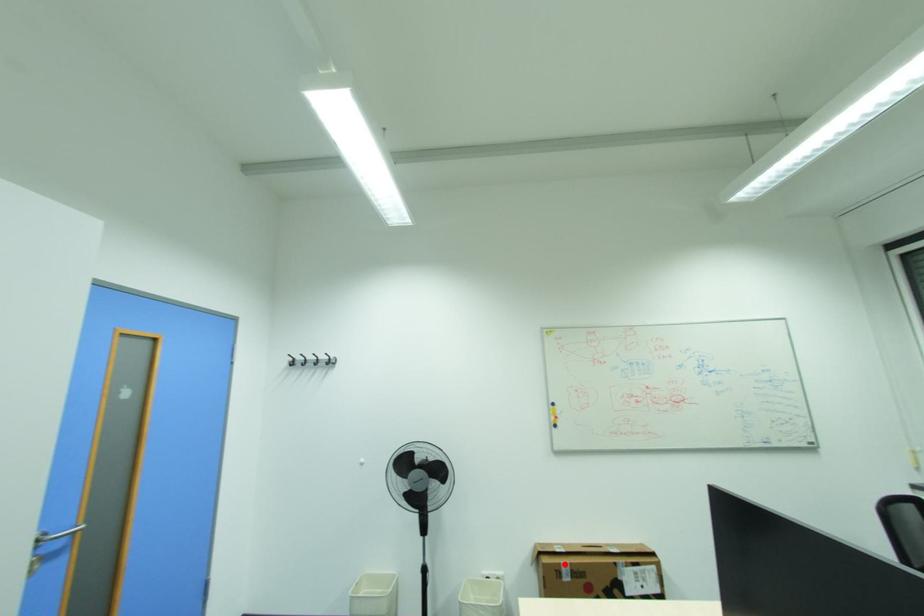
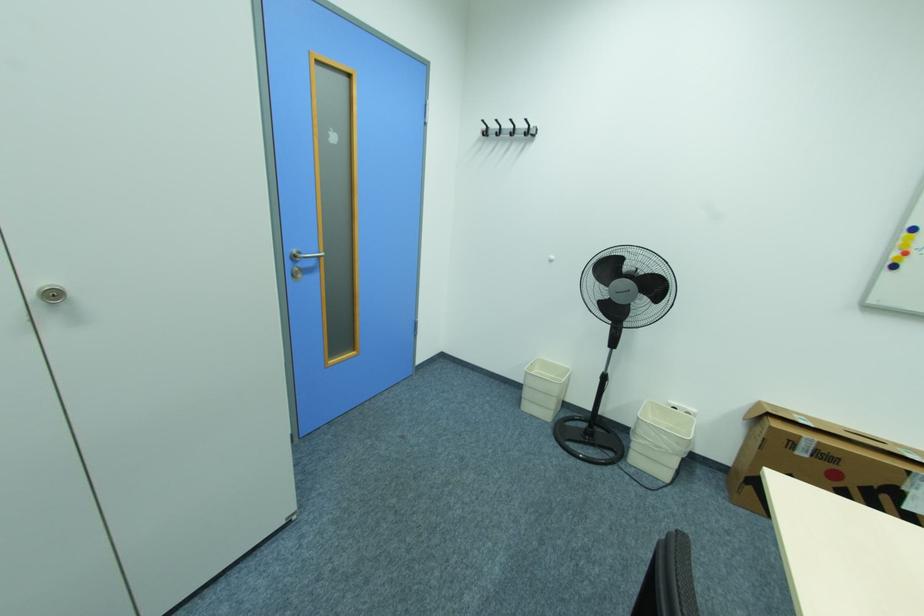
Where in the second image is the point corresponding to the highlighted location from the first image?

(805, 437)